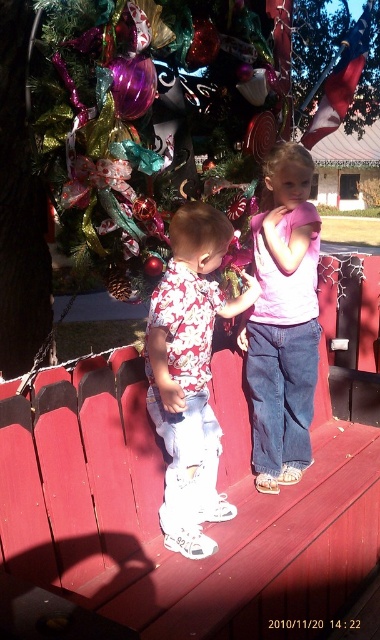
You are a photographer trying to capture a photo of the pink cotton shirt at center and the metallic red flag at upper center. Which object is positioned higher in the image?

The metallic red flag at upper center is positioned higher than the pink cotton shirt at center.

Based on the photo, you are a photographer trying to capture both the floral fabric shirt at center and the metallic red flag at upper center in the same frame. Based on their widths, which object should you zoom in on to ensure both fit in the shot?

The floral fabric shirt at center has a lesser width compared to metallic red flag at upper center, so you should zoom in on the metallic red flag at upper center to accommodate its larger size while still including the floral fabric shirt at center in the frame.